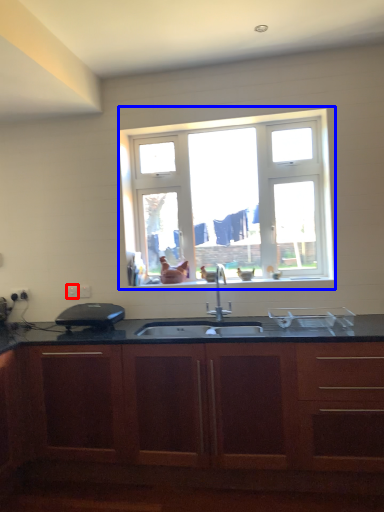
Question: Which of the following is the farthest to the observer, electric outlet (highlighted by a red box) or window (highlighted by a blue box)?

Choices:
 (A) electric outlet
 (B) window

Answer: (A)